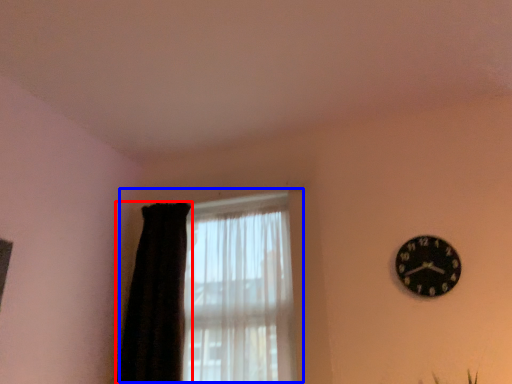
Question: Among these objects, which one is farthest to the camera, curtain (highlighted by a red box) or window (highlighted by a blue box)?

Choices:
 (A) curtain
 (B) window

Answer: (A)